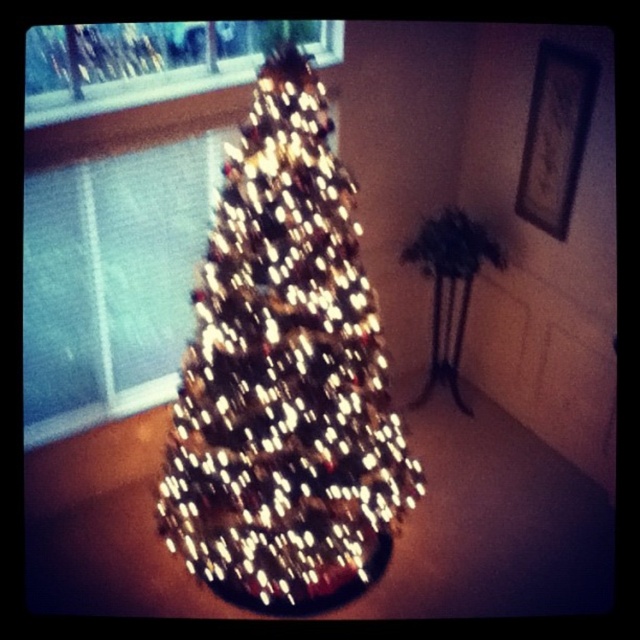
You are planning to move the iridescent glass christmas tree at center to the area where the transparent glass window at upper left is located. Based on their sizes, will the tree fit in the space currently occupied by the window?

The iridescent glass christmas tree at center is wider than the transparent glass window at upper left, so it will not fit in the space currently occupied by the window.

From the picture: Based on the scene description, where is the iridescent glass christmas tree at center located relative to the transparent glass window at upper left?

The iridescent glass christmas tree at center is located to the right of the transparent glass window at upper left.

You are standing in front of the Christmas tree and want to place a decoration on the point closer to you between point (298, 563) and point (61, 211). Which point should you aim for?

You should aim for point (298, 563) because it is closer to you than point (61, 211).